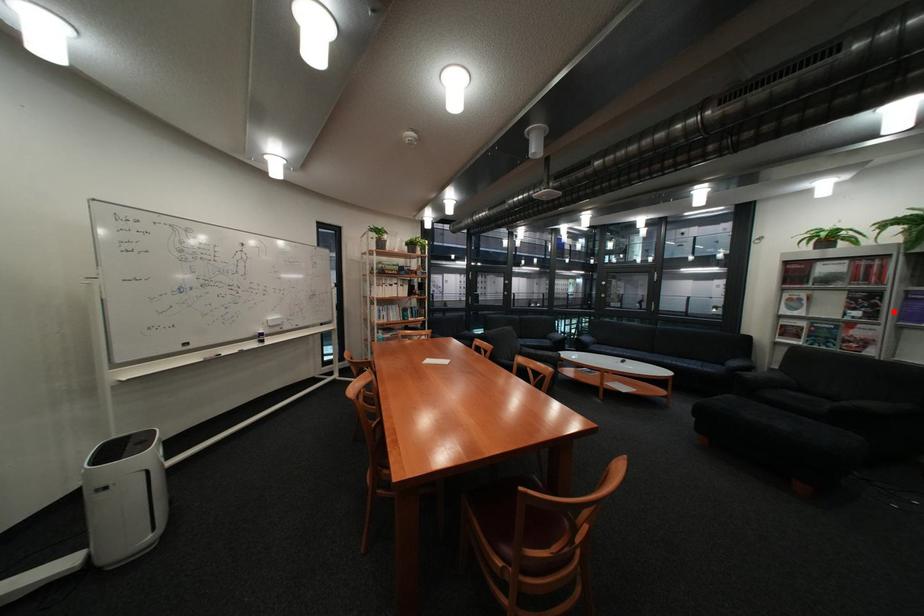
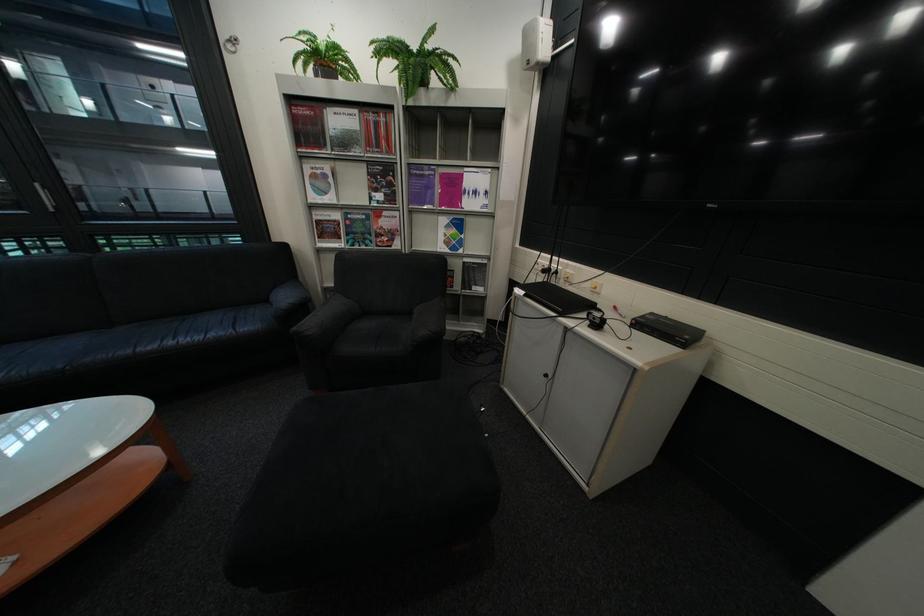
Question: I am providing you with two images of the same scene from different viewpoints. A red point is shown in image1. For the corresponding object point in image2, is it positioned nearer or farther from the camera?

Choices:
 (A) Nearer
 (B) Farther

Answer: (A)